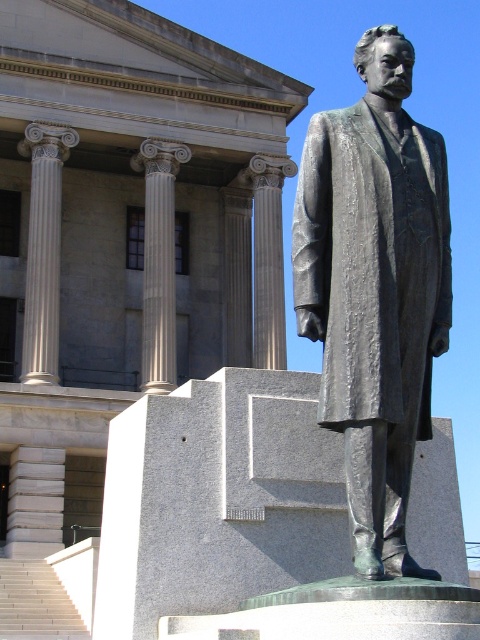
Does point (276, 282) come closer to viewer compared to point (4, 637)?

That is False.

Is sanded stone column at center below white wooden stairs at lower left?

Actually, sanded stone column at center is above white wooden stairs at lower left.

At what (x,y) coordinates should I click in order to perform the action: click on sanded stone column at center. Please return your answer as a coordinate pair (x, y). Looking at the image, I should click on (268, 259).

Identify the location of sanded stone column at center. This screenshot has height=640, width=480. (268, 259).

Can you confirm if white marble column at left is thinner than white marble column at center?

No.

Which is behind, point (34, 355) or point (163, 180)?

Positioned behind is point (163, 180).

Between point (26, 324) and point (151, 321), which one is positioned in front?

Point (26, 324) is in front.

Image resolution: width=480 pixels, height=640 pixels. I want to click on white marble column at left, so click(44, 250).

Is point (52, 259) positioned behind point (284, 157)?

No, (52, 259) is closer to viewer.

You are a GUI agent. You are given a task and a screenshot of the screen. Output one action in this format:
    pyautogui.click(x=<x>, y=<y>)
    Task: Click on the white marble column at left
    The height and width of the screenshot is (640, 480).
    Given the screenshot: What is the action you would take?
    pyautogui.click(x=44, y=250)

This screenshot has width=480, height=640. Identify the location of white marble column at left. (44, 250).